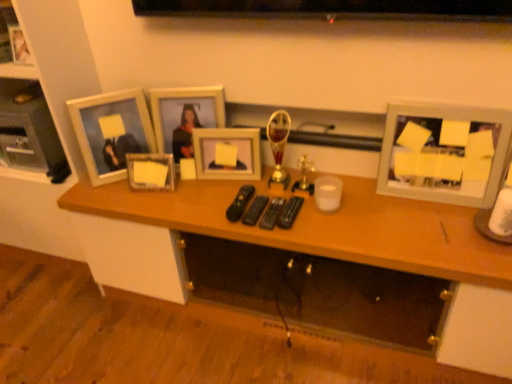
The height and width of the screenshot is (384, 512). In order to click on vacant space to the left of black plastic remote control at center, the 2th remote control when ordered from right to left in this screenshot , I will do `click(214, 208)`.